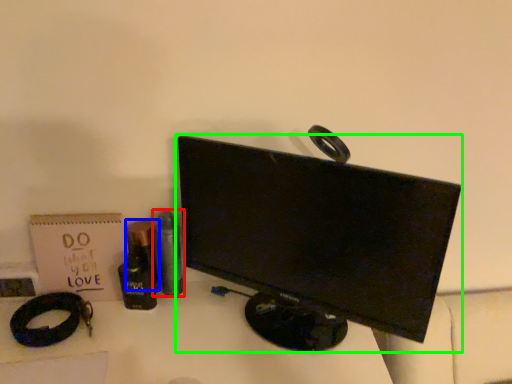
Question: Which is nearer to the toiletry (highlighted by a red box)? toiletry (highlighted by a blue box) or computer monitor (highlighted by a green box).

Choices:
 (A) toiletry
 (B) computer monitor

Answer: (A)